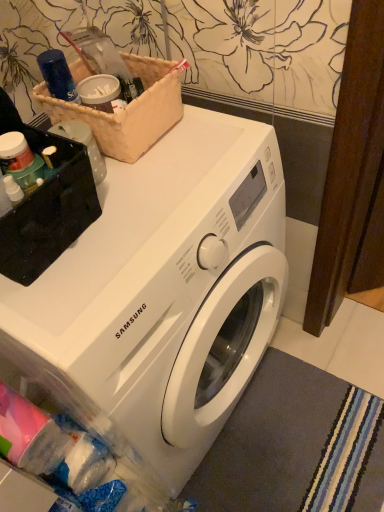
This screenshot has height=512, width=384. I want to click on vacant point above white glossy washing machine at center (from a real-world perspective), so click(x=150, y=203).